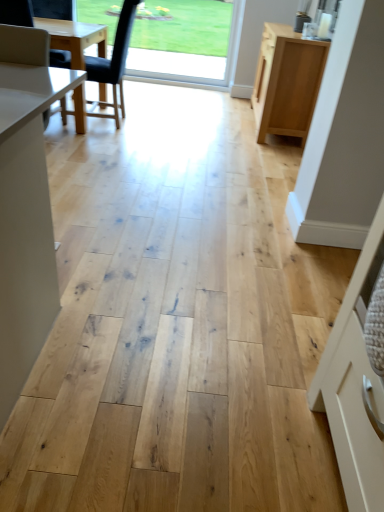
At what (x,y) coordinates should I click in order to perform the action: click on black leather chair at left. Please return your answer as a coordinate pair (x, y). This screenshot has width=384, height=512. Looking at the image, I should click on (114, 62).

This screenshot has height=512, width=384. Find the location of `black leather chair at left`. black leather chair at left is located at coordinates (114, 62).

From the picture: Does light wood cabinet at right come in front of black leather chair at left?

That is False.

Is black leather chair at left inside light wood cabinet at right?

No.

In the image, is light wood cabinet at right on the left side or the right side of black leather chair at left?

light wood cabinet at right is to the right of black leather chair at left.

Is light wood cabinet at right turned away from transparent glass window at upper center?

No.

From the image's perspective, which one is positioned lower, light wood cabinet at right or transparent glass window at upper center?

light wood cabinet at right is shown below in the image.

From a real-world perspective, relative to transparent glass window at upper center, is light wood cabinet at right vertically above or below?

From a real-world perspective, light wood cabinet at right is physically below transparent glass window at upper center.

Between light wood cabinet at right and transparent glass window at upper center, which one has smaller size?

transparent glass window at upper center.

Are black leather chair at left and light wood cabinet at right beside each other?

No, black leather chair at left is not with light wood cabinet at right.

In the scene shown: Considering the relative positions of black leather chair at left and light wood cabinet at right in the image provided, is black leather chair at left in front of light wood cabinet at right?

Yes, black leather chair at left is closer to the camera.

Is black leather chair at left smaller than light wood cabinet at right?

Yes.

From a real-world perspective, is black leather chair at left positioned above or below light wood cabinet at right?

Clearly, from a real-world perspective, black leather chair at left is above light wood cabinet at right.

Considering the sizes of objects transparent glass window at upper center and light wood cabinet at right in the image provided, who is taller, transparent glass window at upper center or light wood cabinet at right?

transparent glass window at upper center.

Does transparent glass window at upper center have a larger size compared to light wood cabinet at right?

No, transparent glass window at upper center is not bigger than light wood cabinet at right.

From a real-world perspective, is transparent glass window at upper center physically below light wood cabinet at right?

No, from a real-world perspective, transparent glass window at upper center is not below light wood cabinet at right.

From the image's perspective, which object appears higher, black leather chair at left or transparent glass window at upper center?

transparent glass window at upper center, from the image's perspective.

Is black leather chair at left at the right side of transparent glass window at upper center?

In fact, black leather chair at left is to the left of transparent glass window at upper center.

Could you tell me if black leather chair at left is facing transparent glass window at upper center?

No, black leather chair at left does not turn towards transparent glass window at upper center.

In the image, is black leather chair at left positioned in front of or behind transparent glass window at upper center?

Clearly, black leather chair at left is in front of transparent glass window at upper center.

Which is in front, point (217, 72) or point (134, 9)?

Point (134, 9)

In terms of height, does transparent glass window at upper center look taller or shorter compared to black leather chair at left?

Clearly, transparent glass window at upper center is shorter compared to black leather chair at left.

Is transparent glass window at upper center at the left side of black leather chair at left?

No, transparent glass window at upper center is not to the left of black leather chair at left.

Locate an element on the screen. The image size is (384, 512). chair in front of the light wood cabinet at right is located at coordinates (114, 62).

At what (x,y) coordinates should I click in order to perform the action: click on cabinetry on the right side of transparent glass window at upper center. Please return your answer as a coordinate pair (x, y). Looking at the image, I should click on (287, 82).

Estimate the real-world distances between objects in this image. Which object is further from light wood cabinet at right, black leather chair at left or transparent glass window at upper center?

transparent glass window at upper center lies further to light wood cabinet at right than the other object.

Which object lies nearer to the anchor point transparent glass window at upper center, black leather chair at left or light wood cabinet at right?

black leather chair at left is closer to transparent glass window at upper center.

Based on their spatial positions, is light wood cabinet at right or transparent glass window at upper center closer to black leather chair at left?

transparent glass window at upper center.

In the scene shown: Based on their spatial positions, is transparent glass window at upper center or black leather chair at left closer to light wood cabinet at right?

black leather chair at left.

Based on their spatial positions, is light wood cabinet at right or black leather chair at left further from transparent glass window at upper center?

light wood cabinet at right is further to transparent glass window at upper center.

In the scene shown: Estimate the real-world distances between objects in this image. Which object is closer to black leather chair at left, transparent glass window at upper center or light wood cabinet at right?

transparent glass window at upper center.

This screenshot has width=384, height=512. What are the coordinates of `cabinetry between black leather chair at left and transparent glass window at upper center along the z-axis` in the screenshot? It's located at (287, 82).